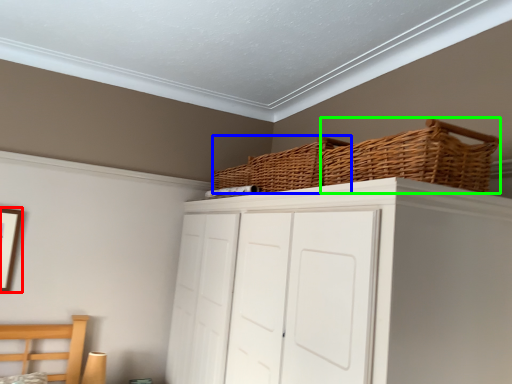
Question: Which object is the closest to the picture frame (highlighted by a red box)? Choose among these: basket (highlighted by a blue box) or basket (highlighted by a green box).

Choices:
 (A) basket
 (B) basket

Answer: (A)